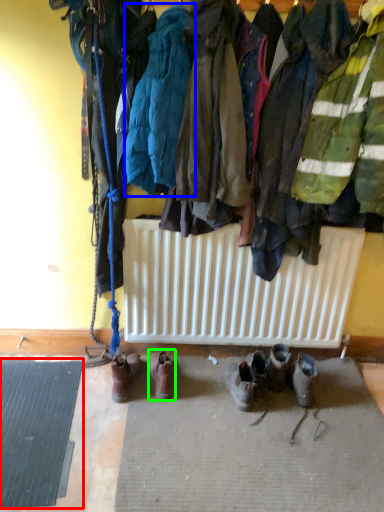
Question: Which is farther away from doormat (highlighted by a red box)? jacket (highlighted by a blue box) or footwear (highlighted by a green box)?

Choices:
 (A) jacket
 (B) footwear

Answer: (A)